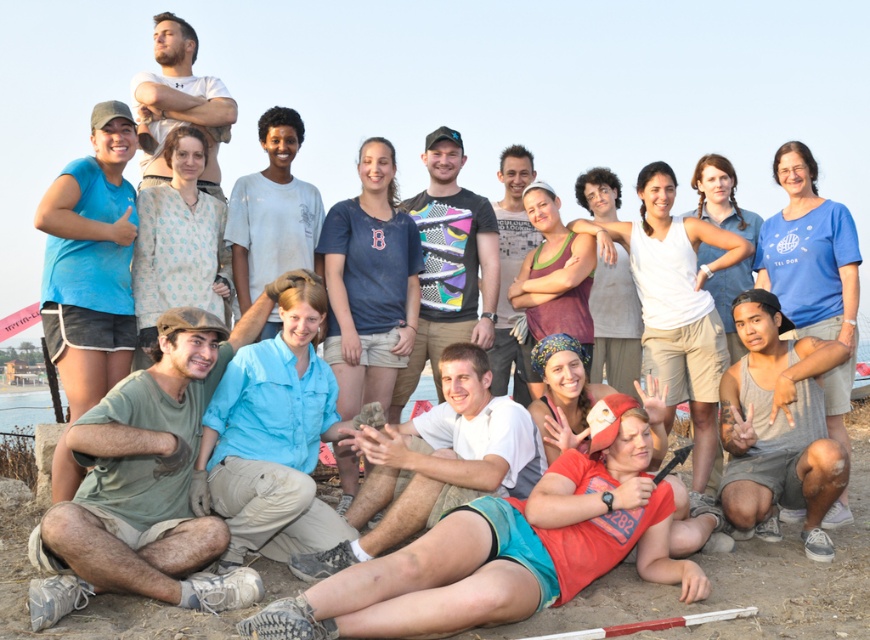
Does gray tank top at lower right have a greater height compared to matte blue shirt at center?

In fact, gray tank top at lower right may be shorter than matte blue shirt at center.

Measure the distance between gray tank top at lower right and camera.

gray tank top at lower right is 6.48 meters away from camera.

Locate an element on the screen. This screenshot has height=640, width=870. gray tank top at lower right is located at coordinates (778, 426).

Does matte blue shirt at left have a greater height compared to gray tank top at lower right?

Correct, matte blue shirt at left is much taller as gray tank top at lower right.

Is point (72, 284) in front of point (808, 403)?

That is False.

Identify the location of matte blue shirt at left. The width and height of the screenshot is (870, 640). (90, 260).

Does light blue shirt at center have a greater width compared to multicolored jersey at center?

Yes.

Is light blue shirt at center taller than multicolored jersey at center?

In fact, light blue shirt at center may be shorter than multicolored jersey at center.

Who is more distant from viewer, (536, 444) or (454, 291)?

The point (454, 291) is behind.

Find the location of a particular element. light blue shirt at center is located at coordinates (437, 461).